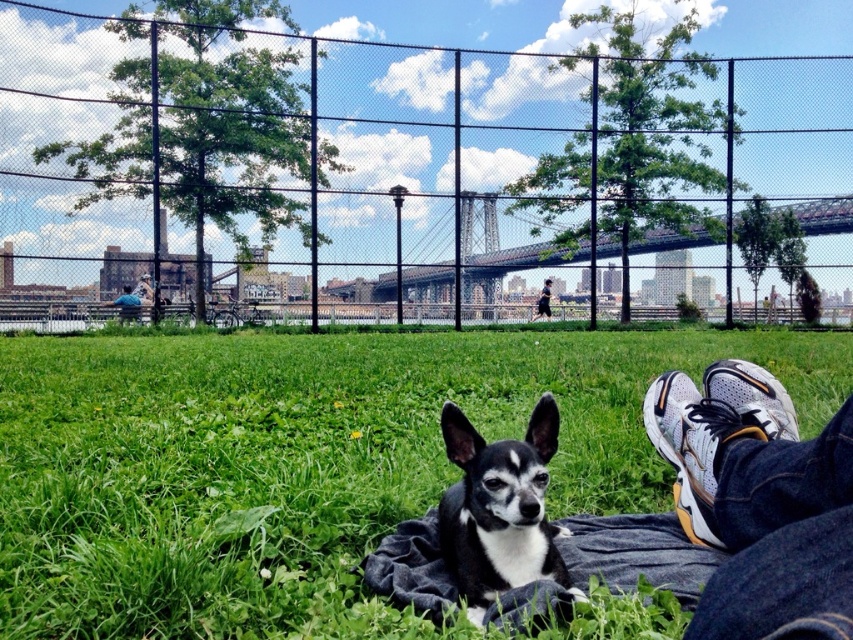
Between black chain-link fence at center and green grass at center, which one has more height?

black chain-link fence at center

Who is more distant from viewer, (640, 285) or (242, 364)?

The point (640, 285) is more distant.

Locate an element on the screen. The image size is (853, 640). black chain-link fence at center is located at coordinates (403, 164).

Does green grass at center have a larger size compared to black and white fur dog at center?

Correct, green grass at center is larger in size than black and white fur dog at center.

Image resolution: width=853 pixels, height=640 pixels. In order to click on green grass at center in this screenshot , I will do `click(305, 461)`.

What are the coordinates of `green grass at center` in the screenshot? It's located at (305, 461).

Is black chain-link fence at center further to camera compared to black fabric pants at lower right?

No, black chain-link fence at center is closer to the viewer.

Can you confirm if black chain-link fence at center is taller than black fabric pants at lower right?

Correct, black chain-link fence at center is much taller as black fabric pants at lower right.

Between point (309, 266) and point (547, 301), which one is positioned behind?

The point (547, 301) is more distant.

You are a GUI agent. You are given a task and a screenshot of the screen. Output one action in this format:
    pyautogui.click(x=<x>, y=<y>)
    Task: Click on the black chain-link fence at center
    
    Given the screenshot: What is the action you would take?
    point(403,164)